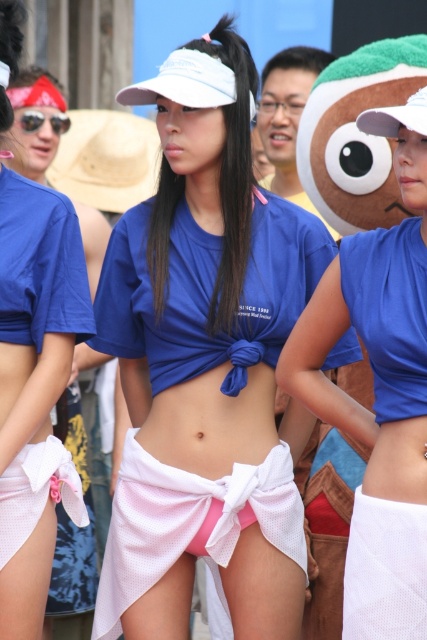
You are a fashion designer observing the image and need to determine which piece of clothing is more suitable for a petite model. Based on the pink mesh underwear at center and the pink mesh underwear at lower left, which one would you recommend?

The pink mesh underwear at lower left is smaller in size and thus more suitable for a petite model.

You are a photographer at the event and need to position yourself to capture both the pink mesh underwear at center and the pink mesh underwear at lower left in the same frame. Which underwear should you position yourself to the right of to ensure both are visible?

You should position yourself to the right of the pink mesh underwear at lower left to include both the pink mesh underwear at center and the pink mesh underwear at lower left in the frame, since the pink mesh underwear at center is to the right of the pink mesh underwear at lower left.

Based on the scene description, can you determine the spatial relationship between the white mesh skirt at center and the white mesh underwear at lower center?

The white mesh skirt at center is located above the white mesh underwear at lower center.